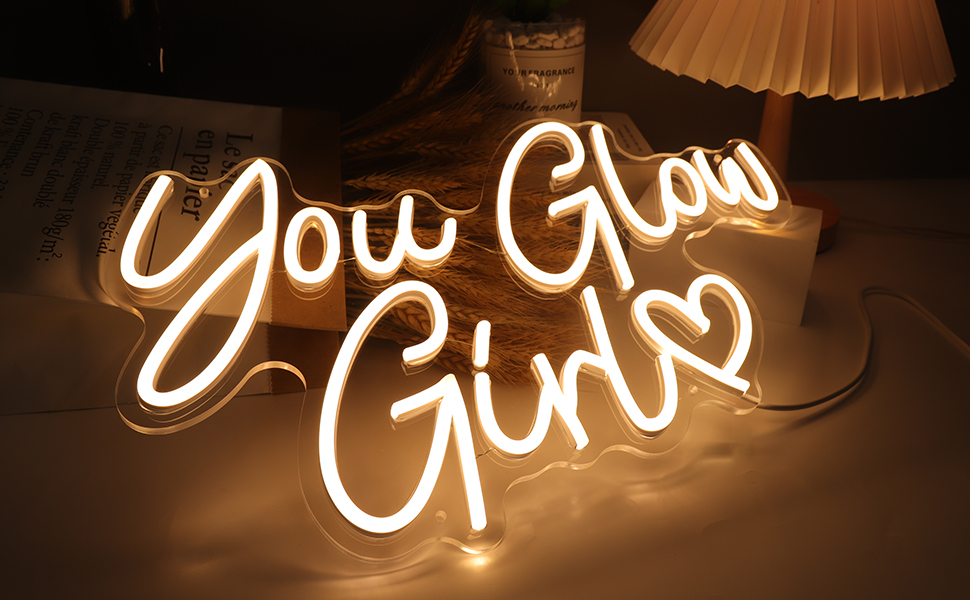
I want to click on box on the right, so click(795, 251).